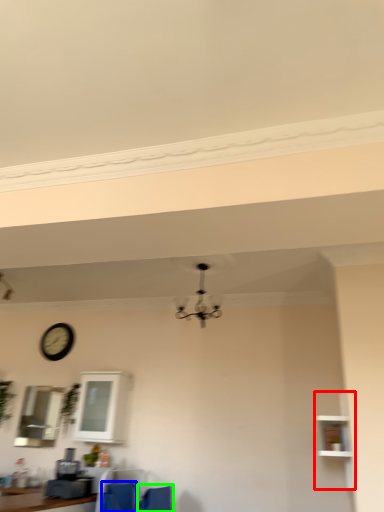
Question: Estimate the real-world distances between objects in this image. Which object is closer to shelf (highlighted by a red box), feeding chair (highlighted by a blue box) or armchair (highlighted by a green box)?

Choices:
 (A) feeding chair
 (B) armchair

Answer: (B)